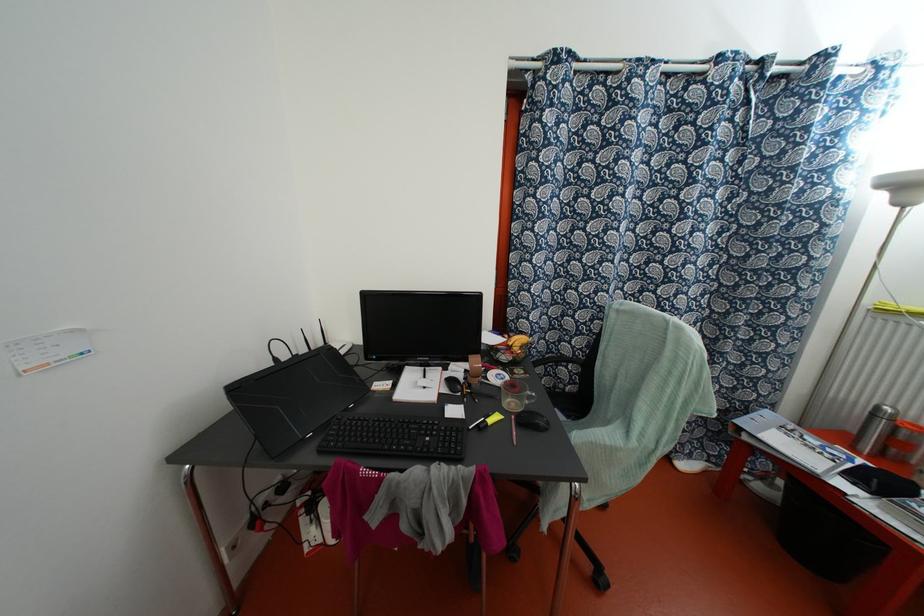
Find where to click the black computer mouse. Please return your answer as a coordinate pair (x, y).

(531, 419)